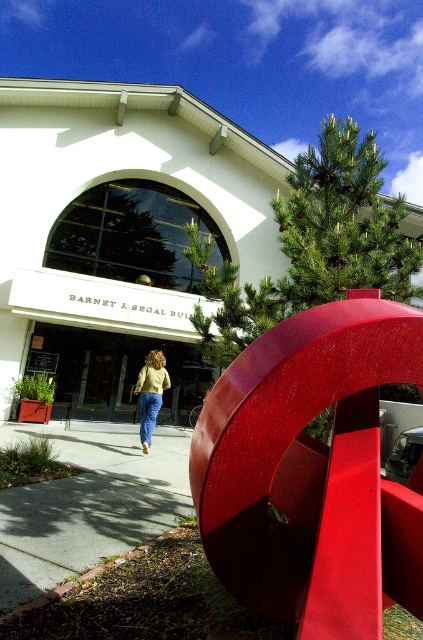
You are standing on the gray concrete sidewalk at lower left and want to see the matte yellow sweater at center. Can you see it without any obstruction?

The gray concrete sidewalk at lower left has a lesser height compared to matte yellow sweater at center, so yes, you can see the matte yellow sweater at center from the gray concrete sidewalk at lower left because it is taller than the sidewalk.

You are standing on the gray concrete sidewalk at lower left and want to reach the matte yellow sweater at center. Which direction should you move to get closer to the sweater?

You should move to the right since the gray concrete sidewalk at lower left is positioned on the left side of the matte yellow sweater at center.